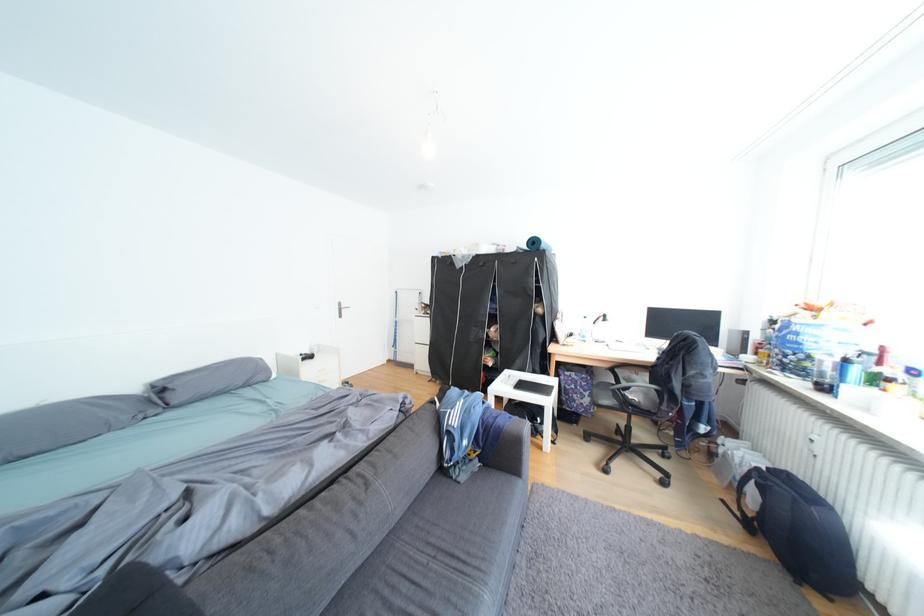
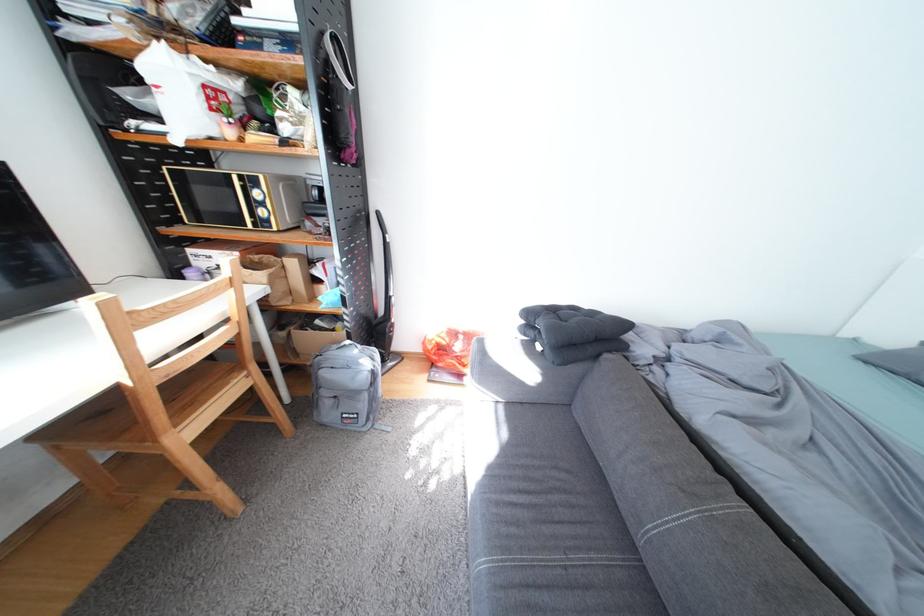
Find the pixel in the second image that matches (x=447, y=559) in the first image.

(578, 569)